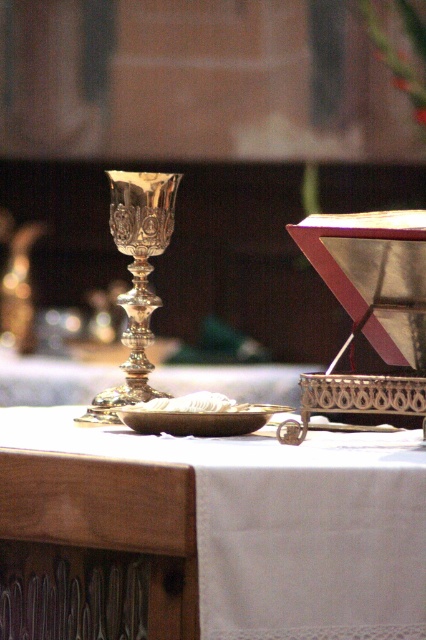
From the picture: You are a priest preparing for a ceremony and need to place a candle between the white lace cloth at center and the polished silver goblet at center. Based on their positions, where should you place the candle?

The white lace cloth at center is to the right of the polished silver goblet at center, so you should place the candle between them by positioning it to the right of the polished silver goblet at center and to the left of the white lace cloth at center.

Based on the photo, you are a priest preparing for a ceremony and need to place a candle between the polished silver goblet at center and the matte gold plate at center. Which object should you place the candle closer to if the candle is taller than the plate but shorter than the goblet?

The polished silver goblet at center is much taller than the matte gold plate at center. Since the candle is shorter than the goblet but taller than the plate, you should place the candle closer to the matte gold plate at center to avoid it being overshadowed by the taller goblet.

You are standing in front of an altar and want to place a small candle on the white lace cloth at center. Based on the coordinates provided, where exactly should you place the candle?

The white lace cloth at center is located at coordinates point (282, 524), so you should place the candle there.